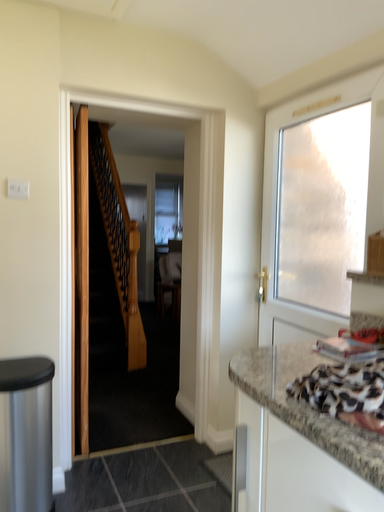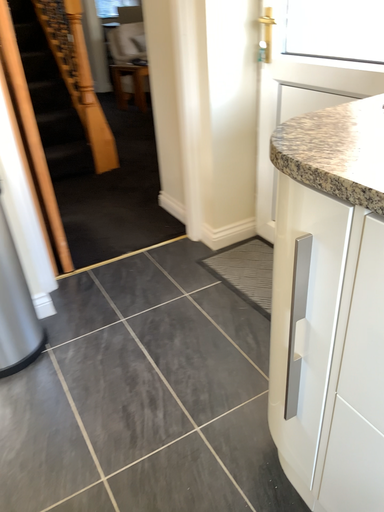
Question: Which way did the camera rotate in the video?

Choices:
 (A) rotated upward
 (B) rotated downward

Answer: (B)